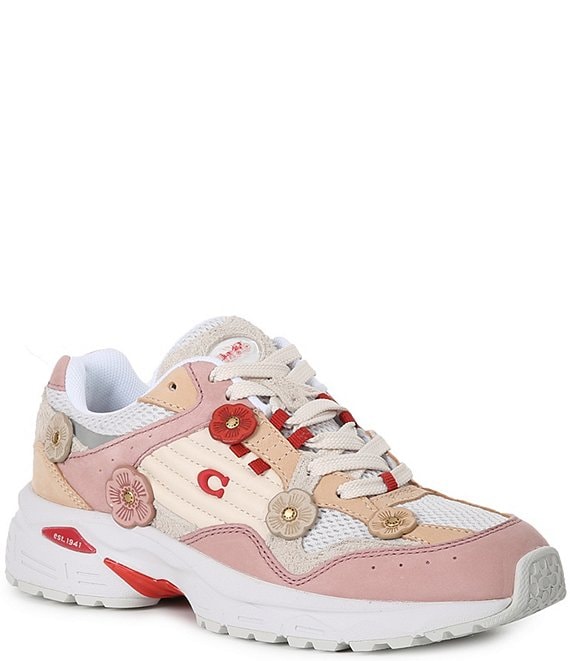
I want to click on flower decorations, so click(x=55, y=434), click(x=135, y=498), click(x=287, y=514), click(x=390, y=523), click(x=231, y=418).